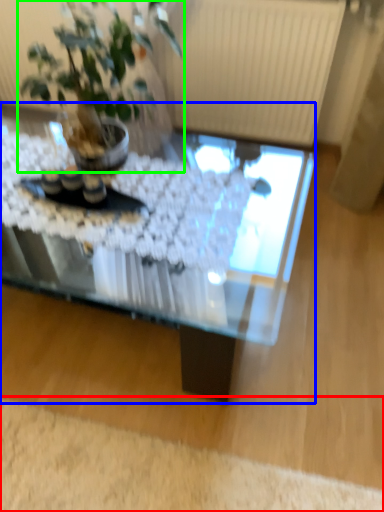
Question: Estimate the real-world distances between objects in this image. Which object is closer to plain (highlighted by a red box), coffee table (highlighted by a blue box) or houseplant (highlighted by a green box)?

Choices:
 (A) coffee table
 (B) houseplant

Answer: (A)